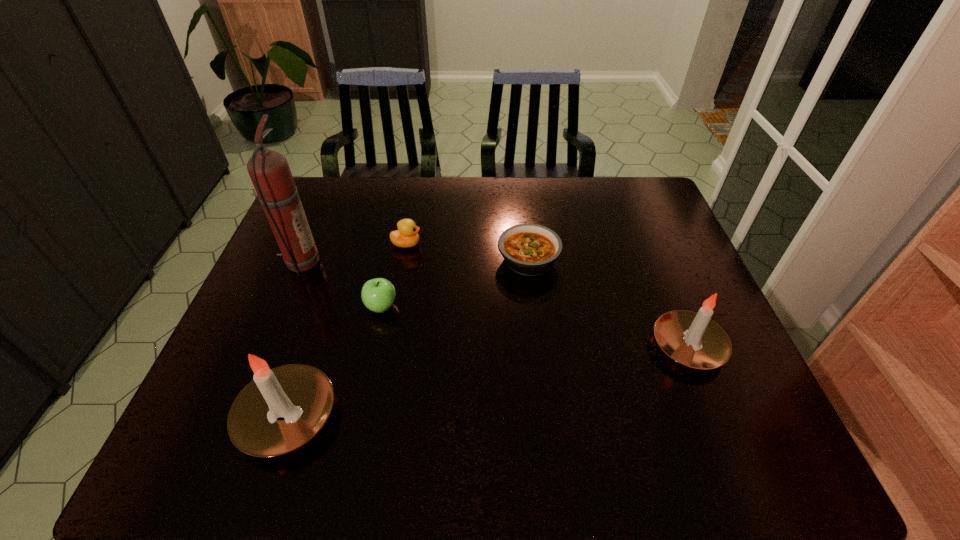
At what (x,y) coordinates should I click in order to perform the action: click on the second tallest object. Please return your answer as a coordinate pair (x, y). This screenshot has width=960, height=540. Looking at the image, I should click on (303, 395).

Locate an element on the screen. Image resolution: width=960 pixels, height=540 pixels. the left candle is located at coordinates (x=303, y=395).

I want to click on the shorter candle, so tap(692, 339).

Locate an element on the screen. The image size is (960, 540). the third tallest object is located at coordinates (692, 339).

The height and width of the screenshot is (540, 960). Identify the location of duckling. (406, 236).

This screenshot has height=540, width=960. What are the coordinates of `the tallest object` in the screenshot? It's located at (269, 171).

Locate an element on the screen. apple is located at coordinates (378, 294).

Where is `stew`? The height and width of the screenshot is (540, 960). stew is located at coordinates (528, 249).

The height and width of the screenshot is (540, 960). In order to click on the fifth object from left to right in this screenshot , I will do `click(528, 249)`.

Where is `free location located on the back of the second tallest object`? This screenshot has height=540, width=960. free location located on the back of the second tallest object is located at coordinates (325, 302).